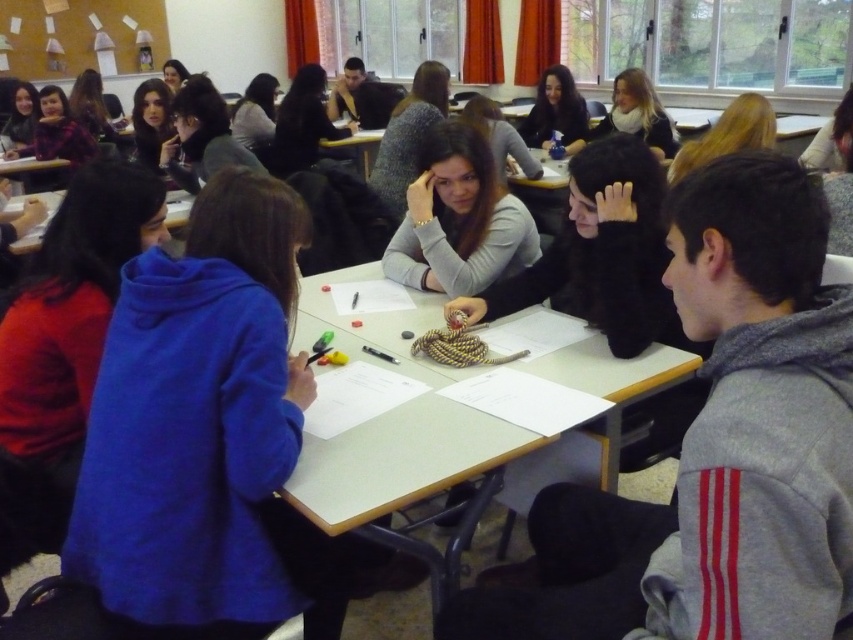
Question: In this image, where is smooth white table at center located relative to matte black hair at upper center?

Choices:
 (A) right
 (B) left

Answer: (B)

Question: Among these points, which one is nearest to the camera?

Choices:
 (A) 480,164
 (B) 451,403
 (C) 624,72

Answer: (B)

Question: Is gray matte sweater at center further to the viewer compared to light brown hair at upper center?

Choices:
 (A) yes
 (B) no

Answer: (B)

Question: Which point is closer to the camera taking this photo?

Choices:
 (A) (798, 212)
 (B) (647, 112)

Answer: (A)

Question: Considering the real-world distances, which object is farthest from the light brown hair at upper center?

Choices:
 (A) matte black hair at upper center
 (B) white paper at center
 (C) smooth white table at center

Answer: (B)

Question: Is gray fleece hoodie at right in front of matte black hair at upper center?

Choices:
 (A) yes
 (B) no

Answer: (A)